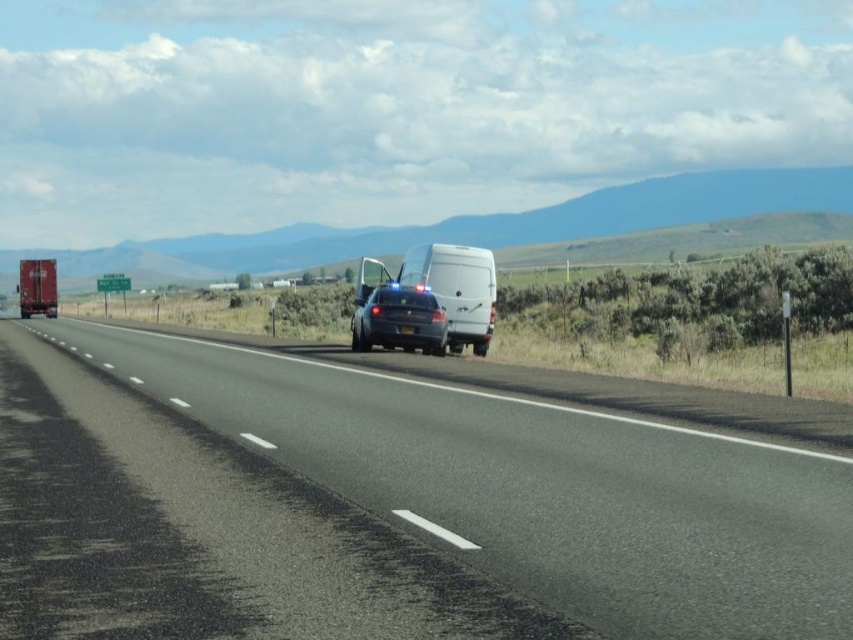
Question: Which object is positioned closest to the black asphalt highway at center?

Choices:
 (A) white matte van at center
 (B) metallic red trailer truck at left

Answer: (A)

Question: Considering the relative positions of black asphalt highway at center and satin black sedan at center in the image provided, where is black asphalt highway at center located with respect to satin black sedan at center?

Choices:
 (A) left
 (B) right

Answer: (A)

Question: Which point appears farthest from the camera in this image?

Choices:
 (A) (482, 337)
 (B) (401, 324)
 (C) (648, 531)

Answer: (A)

Question: Can you confirm if black asphalt highway at center is positioned above satin black sedan at center?

Choices:
 (A) no
 (B) yes

Answer: (A)

Question: Which of the following is the closest to the observer?

Choices:
 (A) black asphalt highway at center
 (B) white matte van at center
 (C) satin black sedan at center
 (D) metallic red trailer truck at left

Answer: (A)

Question: In this image, where is black asphalt highway at center located relative to satin black sedan at center?

Choices:
 (A) right
 (B) left

Answer: (B)